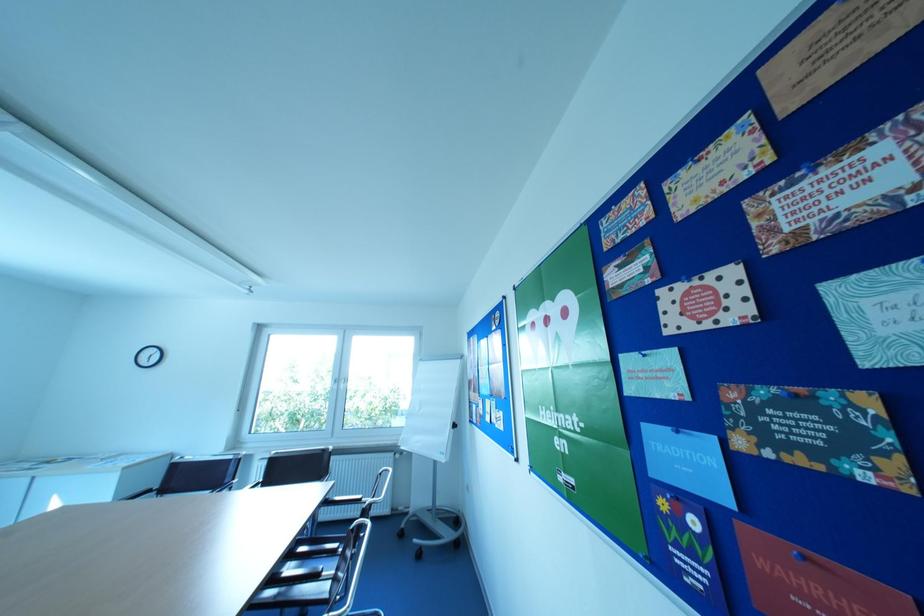
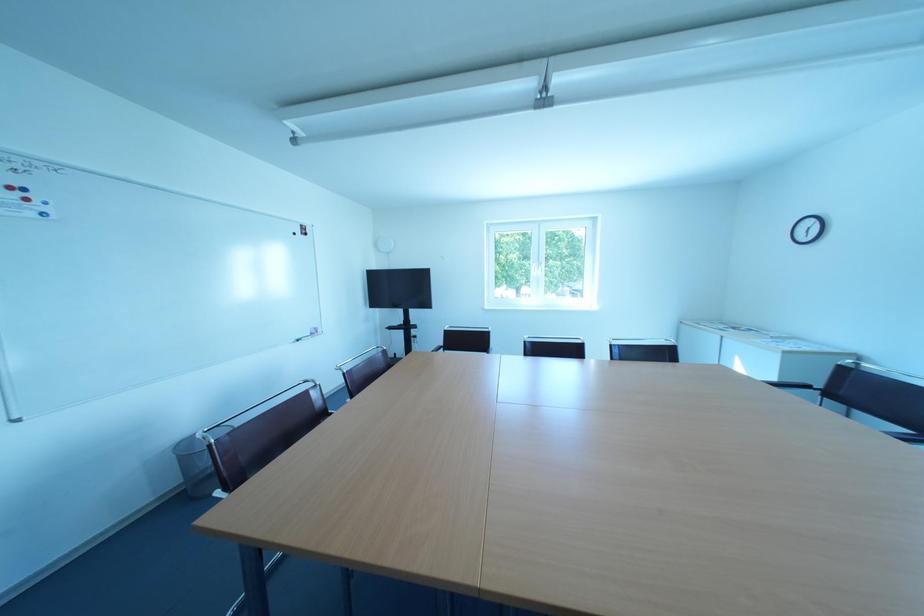
Question: The first image is from the beginning of the video and the second image is from the end. How did the camera likely rotate when shooting the video?

Choices:
 (A) Left
 (B) Right
 (C) Up
 (D) Down

Answer: (A)